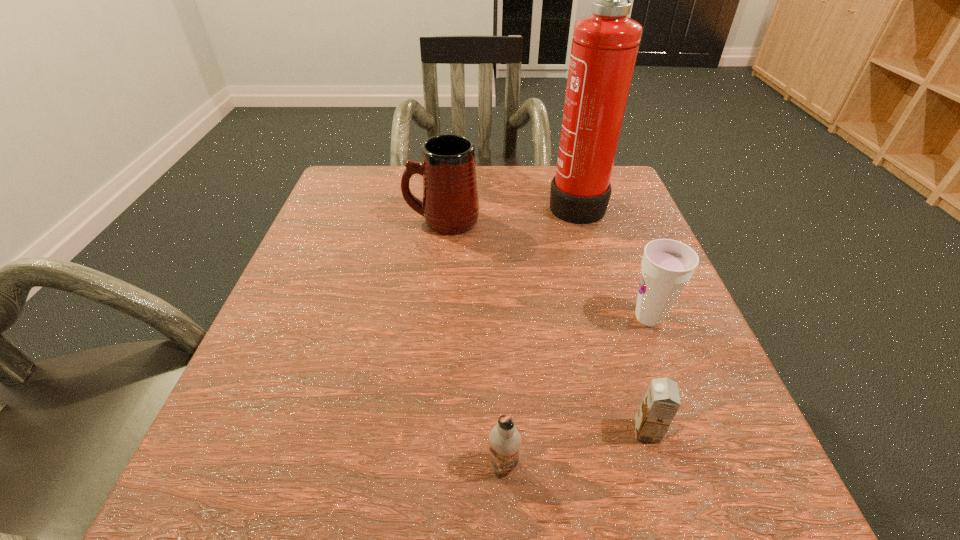
Image resolution: width=960 pixels, height=540 pixels. Identify the location of vacant space that satisfies the following two spatial constraints: 1. on the front-facing side of the tallest object; 2. on the back side of the fourth farthest object. (643, 431).

In order to click on free space that satisfies the following two spatial constraints: 1. on the side of the mug with the handle; 2. on the left side of the fourth farthest object in this screenshot , I will do `click(419, 431)`.